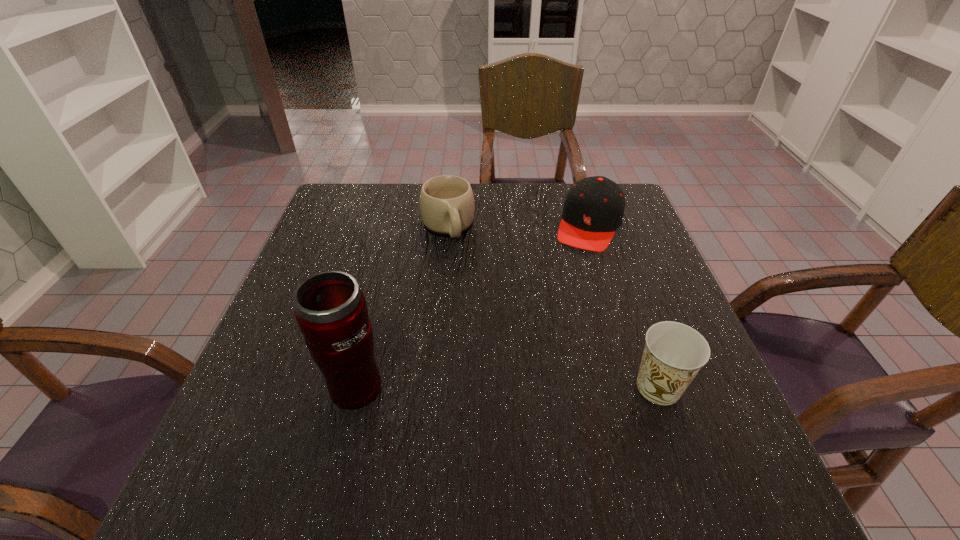
I want to click on object that is positioned at the near left corner, so click(x=331, y=311).

Where is `object located at the far right corner`? This screenshot has height=540, width=960. object located at the far right corner is located at coordinates (593, 210).

The height and width of the screenshot is (540, 960). Identify the location of object situated at the near right corner. (674, 353).

Find the location of a particular element. The width and height of the screenshot is (960, 540). vacant area at the far edge of the desktop is located at coordinates (492, 194).

In the image, there is a desktop. Where is `vacant space at the left edge`? vacant space at the left edge is located at coordinates (320, 259).

In order to click on blank space at the far left corner of the desktop in this screenshot , I will do `click(339, 210)`.

This screenshot has width=960, height=540. I want to click on vacant space at the near left corner, so click(x=283, y=429).

In the image, there is a desktop. In order to click on vacant area at the far right corner in this screenshot , I will do `click(632, 201)`.

What are the coordinates of `unoccupied position between the third object from right to left and the cap` in the screenshot? It's located at (518, 226).

The image size is (960, 540). Identify the location of free space between the thermos bottle and the third object from right to left. coord(400,306).